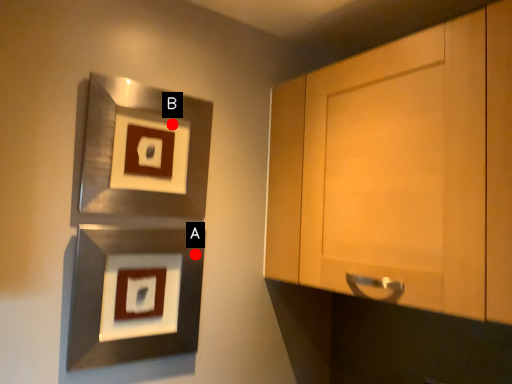
Question: Two points are circled on the image, labeled by A and B beside each circle. Among these points, which one is farthest from the camera?

Choices:
 (A) A is further
 (B) B is further

Answer: (A)